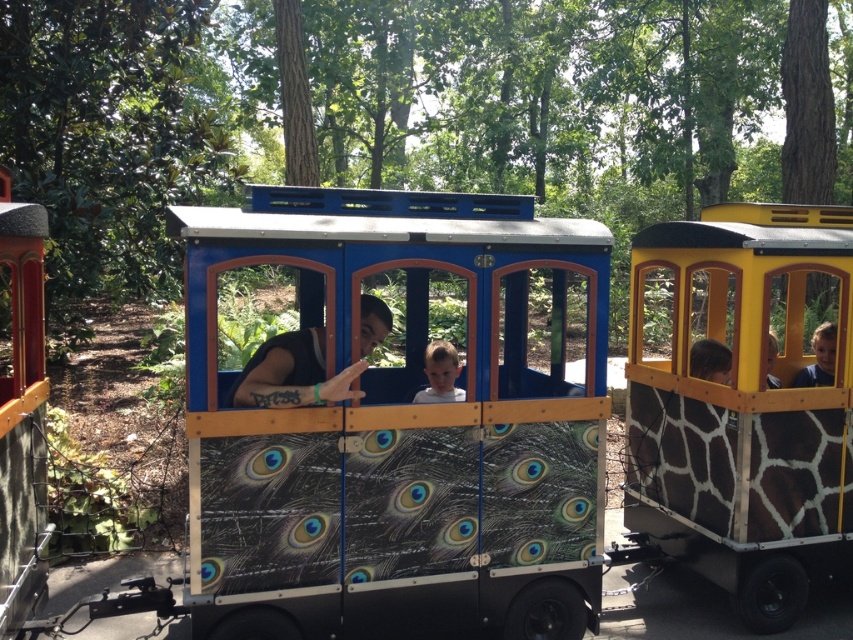
Question: Considering the real-world distances, which object is farthest from the yellow giraffe-patterned wagon at right?

Choices:
 (A) peacock feather wallpapered wagon at center
 (B) brown hair at center

Answer: (A)

Question: In this image, where is peacock feather wallpapered wagon at center located relative to black matte shirt at center?

Choices:
 (A) above
 (B) below

Answer: (B)

Question: Can you confirm if smooth brown hair at right is positioned to the right of brown hair at center?

Choices:
 (A) no
 (B) yes

Answer: (B)

Question: Which of the following is the closest to the observer?

Choices:
 (A) peacock feather wallpapered wagon at center
 (B) yellow giraffe-patterned wagon at right
 (C) light brown hair at center

Answer: (C)

Question: Among these objects, which one is nearest to the camera?

Choices:
 (A) smooth brown hair at right
 (B) light brown wooden face at center

Answer: (B)

Question: Can you confirm if yellow giraffe-patterned wagon at right is wider than brown hair at center?

Choices:
 (A) no
 (B) yes

Answer: (B)